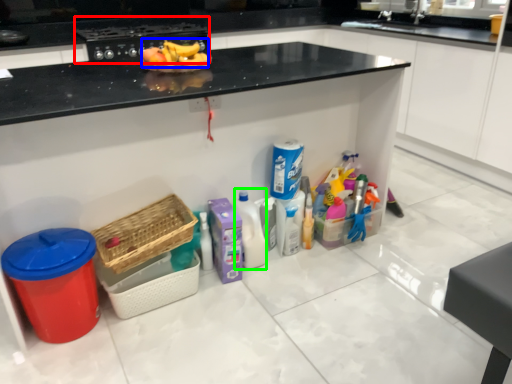
Question: Estimate the real-world distances between objects in this image. Which object is farther from appliance (highlighted by a red box), fruit (highlighted by a blue box) or cleaning product (highlighted by a green box)?

Choices:
 (A) fruit
 (B) cleaning product

Answer: (B)